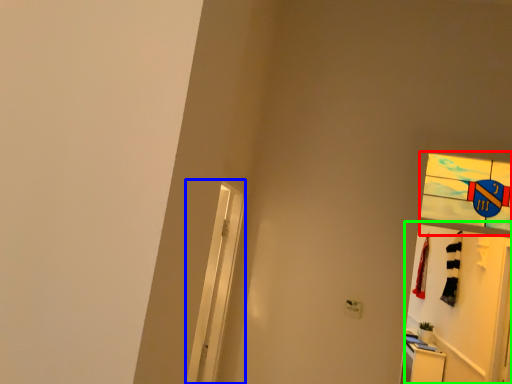
Question: Considering the real-world distances, which object is farthest from glass window (highlighted by a red box)? screen door (highlighted by a blue box) or door (highlighted by a green box)?

Choices:
 (A) screen door
 (B) door

Answer: (B)